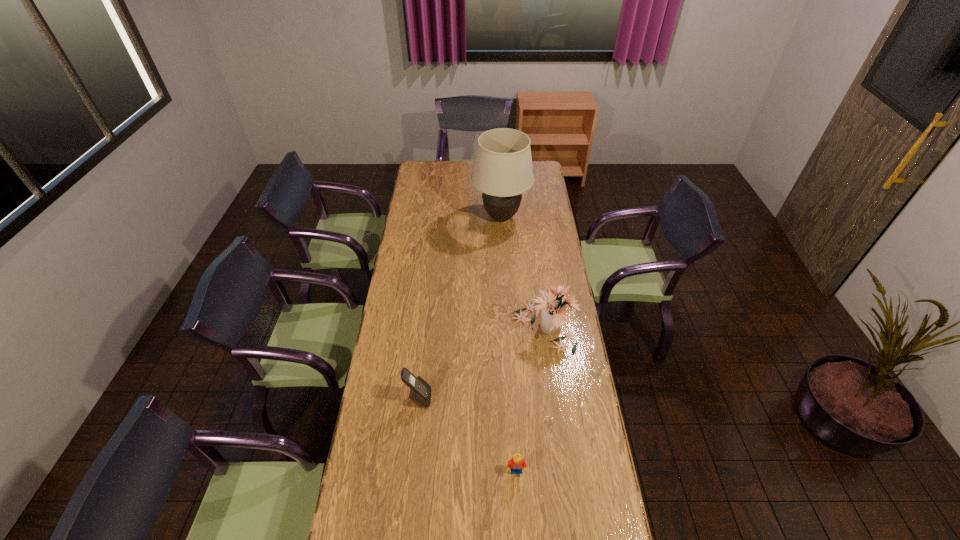
Locate an element on the screen. Image resolution: width=960 pixels, height=540 pixels. unoccupied position between the third shortest object and the lampshade is located at coordinates (522, 272).

At what (x,y) coordinates should I click in order to perform the action: click on unoccupied position between the bouquet and the tallest object. Please return your answer as a coordinate pair (x, y). The width and height of the screenshot is (960, 540). Looking at the image, I should click on pos(522,272).

You are a GUI agent. You are given a task and a screenshot of the screen. Output one action in this format:
    pyautogui.click(x=<x>, y=<y>)
    Task: Click on the empty location between the second farthest object and the nearest object
    The height and width of the screenshot is (540, 960).
    Given the screenshot: What is the action you would take?
    pyautogui.click(x=530, y=400)

At what (x,y) coordinates should I click in order to perform the action: click on free point between the farthest object and the leftmost object. Please return your answer as a coordinate pair (x, y). This screenshot has width=960, height=540. Looking at the image, I should click on (460, 308).

Locate an element on the screen. The width and height of the screenshot is (960, 540). vacant space that is in between the lampshade and the shortest object is located at coordinates (509, 345).

Locate an element on the screen. free space between the second shortest object and the tallest object is located at coordinates (460, 308).

Where is `empty space that is in between the shortest object and the third tallest object`? The width and height of the screenshot is (960, 540). empty space that is in between the shortest object and the third tallest object is located at coordinates (468, 435).

Locate an element on the screen. The height and width of the screenshot is (540, 960). blank region between the second farthest object and the nearest object is located at coordinates (530, 400).

Identify which object is the second nearest to the lampshade. Please provide its 2D coordinates. Your answer should be formatted as a tuple, i.e. [(x, y)], where the tuple contains the x and y coordinates of a point satisfying the conditions above.

[(420, 391)]

Locate an element on the screen. object that is the closest one to the second shortest object is located at coordinates (x=515, y=465).